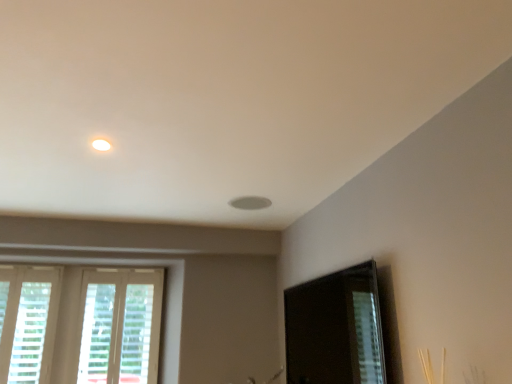
What do you see at coordinates (335, 329) in the screenshot? I see `transparent glass screen door at lower right` at bounding box center [335, 329].

At what (x,y) coordinates should I click in order to perform the action: click on white wooden window at lower left, the second window when ordered from left to right. Please return your answer as a coordinate pair (x, y). This screenshot has width=512, height=384. Looking at the image, I should click on (120, 326).

Are white textured blinds at lower left, the second window when ordered from right to left, and transparent glass screen door at lower right located far from each other?

Yes.

From a real-world perspective, which is physically above, white textured blinds at lower left, which appears as the 1th window when viewed from the left, or transparent glass screen door at lower right?

white textured blinds at lower left, which appears as the 1th window when viewed from the left, from a real-world perspective.

Between white textured blinds at lower left, the second window when ordered from right to left, and transparent glass screen door at lower right, which one has larger size?

transparent glass screen door at lower right.

Which is in front, point (44, 288) or point (316, 356)?

Point (316, 356)

Is white wooden window at lower left, which ranks as the first window in right-to-left order, positioned far away from white textured blinds at lower left, which appears as the 1th window when viewed from the left?

white wooden window at lower left, which ranks as the first window in right-to-left order, is actually quite close to white textured blinds at lower left, which appears as the 1th window when viewed from the left.

Based on their positions, is white wooden window at lower left, the second window when ordered from left to right, located to the left or right of white textured blinds at lower left, the second window when ordered from right to left?

Clearly, white wooden window at lower left, the second window when ordered from left to right, is on the right of white textured blinds at lower left, the second window when ordered from right to left, in the image.

From a real-world perspective, who is located higher, white wooden window at lower left, the second window when ordered from left to right, or white textured blinds at lower left, the second window when ordered from right to left?

From a 3D spatial view, white textured blinds at lower left, the second window when ordered from right to left, is above.

Which is behind, point (308, 383) or point (153, 274)?

The point (153, 274) is farther from the camera.

Between transparent glass screen door at lower right and white wooden window at lower left, which ranks as the first window in right-to-left order, which one has larger size?

With larger size is transparent glass screen door at lower right.

Which of these two, transparent glass screen door at lower right or white wooden window at lower left, which ranks as the first window in right-to-left order, stands taller?

Standing taller between the two is white wooden window at lower left, which ranks as the first window in right-to-left order.

Does point (143, 329) come farther from viewer compared to point (346, 333)?

That is True.

Is white wooden window at lower left, the second window when ordered from left to right, smaller than transparent glass screen door at lower right?

Yes.

From a real-world perspective, is white wooden window at lower left, the second window when ordered from left to right, physically below transparent glass screen door at lower right?

No, from a real-world perspective, white wooden window at lower left, the second window when ordered from left to right, is not under transparent glass screen door at lower right.

Could you tell me if white wooden window at lower left, which ranks as the first window in right-to-left order, is facing transparent glass screen door at lower right?

No, white wooden window at lower left, which ranks as the first window in right-to-left order, is not oriented towards transparent glass screen door at lower right.

Is transparent glass screen door at lower right inside the boundaries of white textured blinds at lower left, the second window when ordered from right to left, or outside?

transparent glass screen door at lower right is not enclosed by white textured blinds at lower left, the second window when ordered from right to left.

From the image's perspective, between transparent glass screen door at lower right and white textured blinds at lower left, the second window when ordered from right to left, who is located below?

white textured blinds at lower left, the second window when ordered from right to left.

Who is bigger, transparent glass screen door at lower right or white textured blinds at lower left, which appears as the 1th window when viewed from the left?

transparent glass screen door at lower right.

What are the coordinates of `screen door that appears in front of the white textured blinds at lower left, which appears as the 1th window when viewed from the left` in the screenshot? It's located at click(x=335, y=329).

Measure the distance between white textured blinds at lower left, the second window when ordered from right to left, and white wooden window at lower left, the second window when ordered from left to right.

white textured blinds at lower left, the second window when ordered from right to left, is 14.51 inches away from white wooden window at lower left, the second window when ordered from left to right.

From the picture: Does white textured blinds at lower left, which appears as the 1th window when viewed from the left, have a lesser height compared to white wooden window at lower left, which ranks as the first window in right-to-left order?

Yes, white textured blinds at lower left, which appears as the 1th window when viewed from the left, is shorter than white wooden window at lower left, which ranks as the first window in right-to-left order.

Which is behind, point (9, 320) or point (113, 293)?

The point (113, 293) is more distant.

From a real-world perspective, which window is the 2nd one above the transparent glass screen door at lower right? Please provide its 2D coordinates.

[(28, 322)]

You are a GUI agent. You are given a task and a screenshot of the screen. Output one action in this format:
    pyautogui.click(x=<x>, y=<y>)
    Task: Click on the window on the left of the white wooden window at lower left, the second window when ordered from left to right
    
    Given the screenshot: What is the action you would take?
    pyautogui.click(x=28, y=322)

Based on their spatial positions, is transparent glass screen door at lower right or white textured blinds at lower left, which appears as the 1th window when viewed from the left, closer to white wooden window at lower left, the second window when ordered from left to right?

white textured blinds at lower left, which appears as the 1th window when viewed from the left.

Based on their spatial positions, is white textured blinds at lower left, the second window when ordered from right to left, or white wooden window at lower left, which ranks as the first window in right-to-left order, further from transparent glass screen door at lower right?

white textured blinds at lower left, the second window when ordered from right to left, is further to transparent glass screen door at lower right.

Looking at the image, which one is located closer to white textured blinds at lower left, which appears as the 1th window when viewed from the left, white wooden window at lower left, the second window when ordered from left to right, or transparent glass screen door at lower right?

Based on the image, white wooden window at lower left, the second window when ordered from left to right, appears to be nearer to white textured blinds at lower left, which appears as the 1th window when viewed from the left.

When comparing their distances from white textured blinds at lower left, the second window when ordered from right to left, does transparent glass screen door at lower right or white wooden window at lower left, the second window when ordered from left to right, seem further?

transparent glass screen door at lower right is positioned further to the anchor white textured blinds at lower left, the second window when ordered from right to left.

Based on their spatial positions, is white wooden window at lower left, which ranks as the first window in right-to-left order, or white textured blinds at lower left, which appears as the 1th window when viewed from the left, closer to transparent glass screen door at lower right?

white wooden window at lower left, which ranks as the first window in right-to-left order.

Considering their positions, is white textured blinds at lower left, which appears as the 1th window when viewed from the left, positioned further to white wooden window at lower left, the second window when ordered from left to right, than transparent glass screen door at lower right?

The object further to white wooden window at lower left, the second window when ordered from left to right, is transparent glass screen door at lower right.

This screenshot has width=512, height=384. What are the coordinates of `window between white textured blinds at lower left, which appears as the 1th window when viewed from the left, and transparent glass screen door at lower right` in the screenshot? It's located at (120, 326).